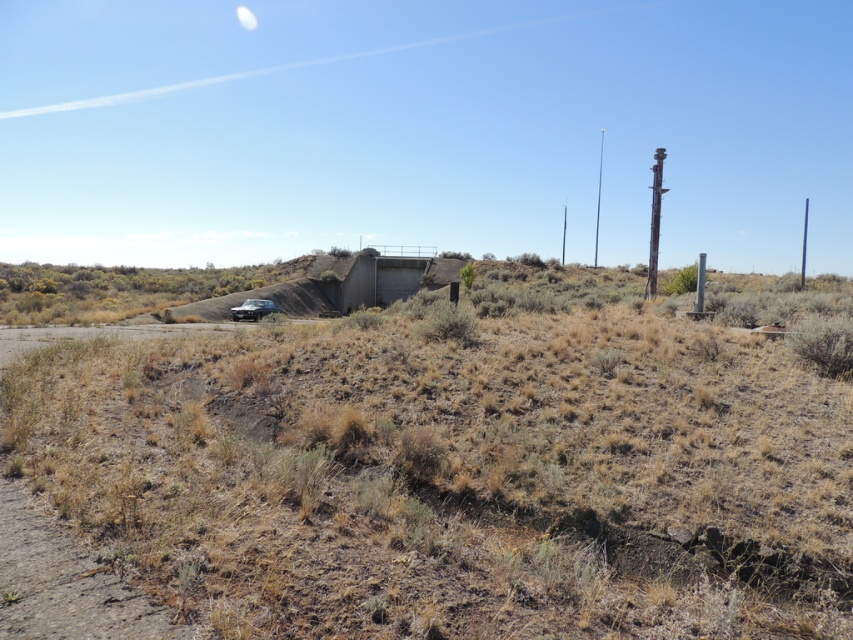
You are a photographer trying to capture the metallic silver car at center without the weathered wood telegraph pole at right blocking the view. Based on their positions, is it possible to frame the shot so the car is fully visible while avoiding the pole?

The weathered wood telegraph pole at right is positioned over the metallic silver car at center, so it would block the view of the car. To avoid the pole, you would need to adjust your angle or position to ensure the pole is not directly above the car in the frame.